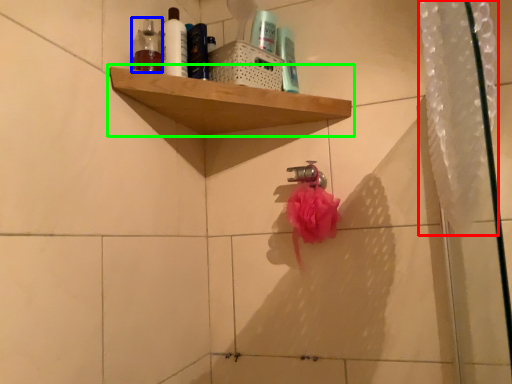
Question: Based on their relative distances, which object is nearer to shower curtain (highlighted by a red box)? Choose from toiletry (highlighted by a blue box) and shelf (highlighted by a green box).

Choices:
 (A) toiletry
 (B) shelf

Answer: (B)